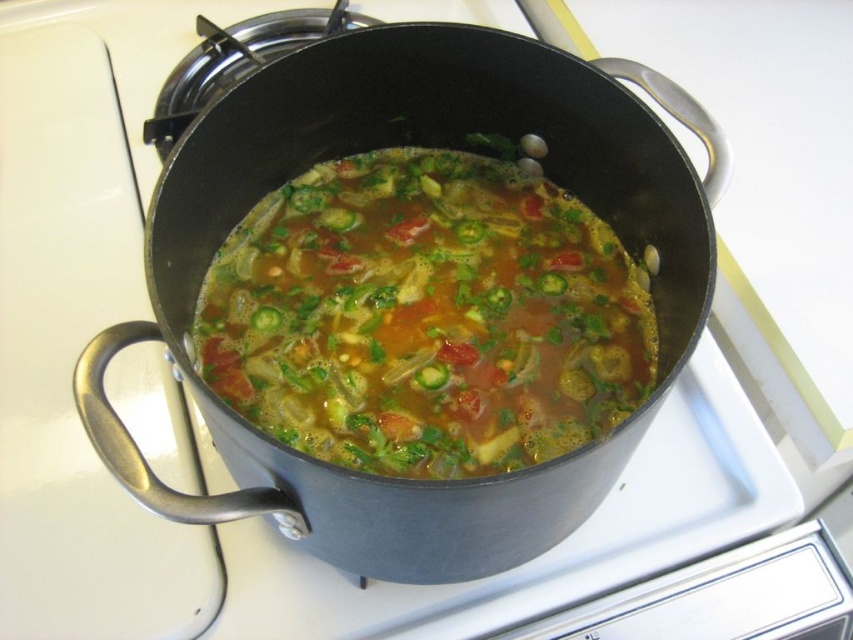
Question: Is black matte pot at center to the left of brown glossy soup at center from the viewer's perspective?

Choices:
 (A) no
 (B) yes

Answer: (B)

Question: Can you confirm if black matte pot at center is positioned to the left of brown glossy soup at center?

Choices:
 (A) yes
 (B) no

Answer: (A)

Question: Can you confirm if black matte pot at center is bigger than brown glossy soup at center?

Choices:
 (A) no
 (B) yes

Answer: (B)

Question: Among these objects, which one is nearest to the camera?

Choices:
 (A) black matte pot at center
 (B) brown glossy soup at center

Answer: (A)